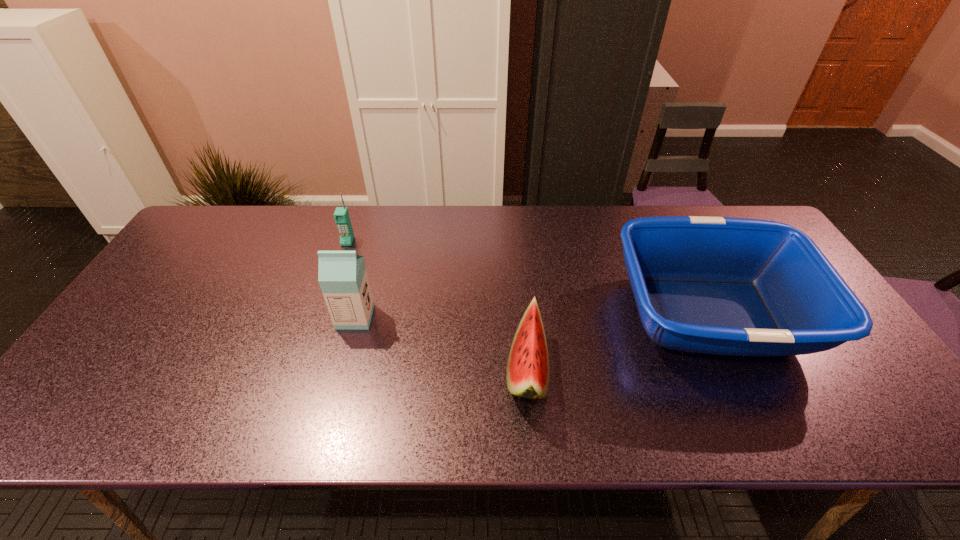
In order to click on free location located on the outer rind of the third object from left to right in this screenshot , I will do `click(446, 371)`.

At what (x,y) coordinates should I click in order to perform the action: click on vacant space located 0.400m on the outer rind of the third object from left to right. Please return your answer as a coordinate pair (x, y). Looking at the image, I should click on (337, 371).

Identify the location of object that is at the far edge. (341, 215).

At what (x,y) coordinates should I click in order to perform the action: click on object at the near edge. Please return your answer as a coordinate pair (x, y). The height and width of the screenshot is (540, 960). Looking at the image, I should click on (528, 374).

This screenshot has width=960, height=540. Find the location of `object that is at the right edge`. object that is at the right edge is located at coordinates (730, 286).

The width and height of the screenshot is (960, 540). In the image, there is a desktop. Find the location of `vacant space at the far edge`. vacant space at the far edge is located at coordinates (522, 224).

Where is `vacant space at the near edge of the desktop`? This screenshot has width=960, height=540. vacant space at the near edge of the desktop is located at coordinates (794, 434).

The image size is (960, 540). I want to click on vacant space at the left edge of the desktop, so click(114, 350).

Locate an element on the screen. The height and width of the screenshot is (540, 960). blank space at the near left corner is located at coordinates (60, 430).

Locate an element on the screen. Image resolution: width=960 pixels, height=540 pixels. free space at the far right corner of the desktop is located at coordinates (710, 205).